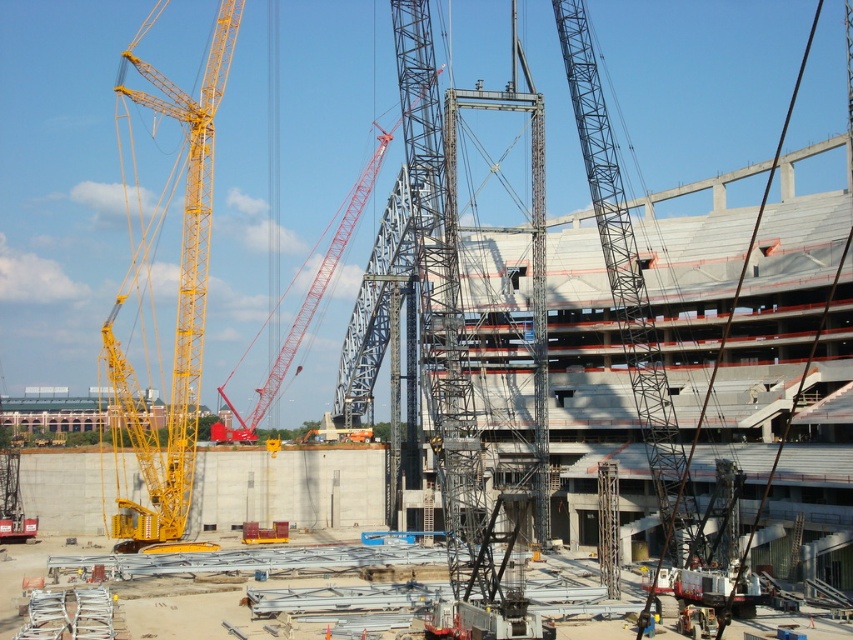
Question: Which point is farther to the camera?

Choices:
 (A) (193, 173)
 (B) (312, 301)

Answer: (B)

Question: Is red metallic crane at center to the left of dark blue uniform at center from the viewer's perspective?

Choices:
 (A) yes
 (B) no

Answer: (A)

Question: In this image, where is yellow metallic crane at left located relative to dark blue uniform at center?

Choices:
 (A) below
 (B) above

Answer: (B)

Question: Does red metallic crane at center have a smaller size compared to dark blue uniform at center?

Choices:
 (A) yes
 (B) no

Answer: (B)

Question: Which object appears farthest from the camera in this image?

Choices:
 (A) metallic gray crane at center
 (B) red metallic crane at center
 (C) dark blue uniform at center

Answer: (B)

Question: Which point is farther to the camera?

Choices:
 (A) (231, 433)
 (B) (177, 458)
 (C) (664, 413)

Answer: (A)